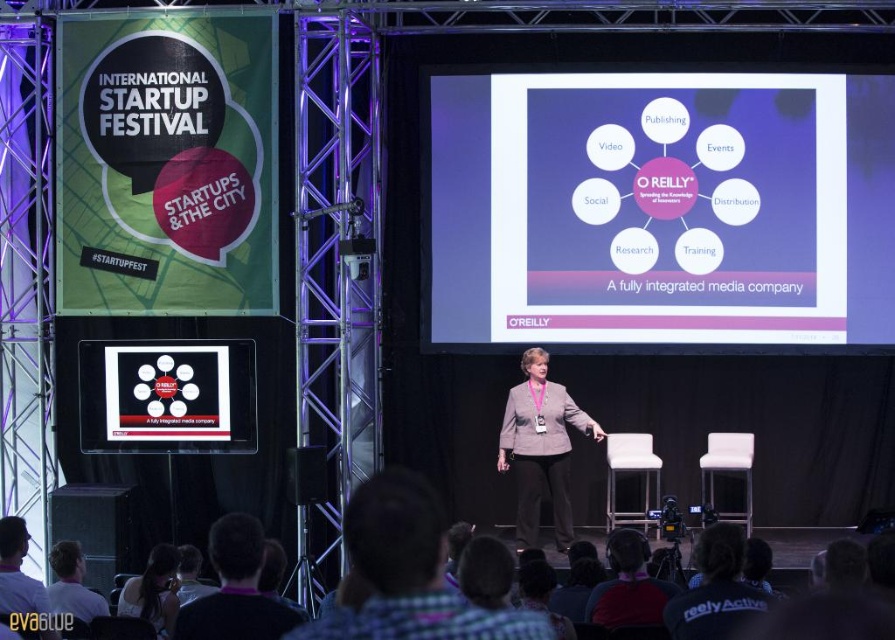
Question: Which point is farther from the camera taking this photo?

Choices:
 (A) (538, 408)
 (B) (232, 365)
 (C) (128, 556)

Answer: (B)

Question: Which point is closer to the camera?

Choices:
 (A) (663, 605)
 (B) (103, 397)

Answer: (A)

Question: Is green fabric banner at upper left smaller than dark gray fabric at lower center?

Choices:
 (A) no
 (B) yes

Answer: (B)

Question: Considering the real-world distances, which object is farthest from the dark gray fabric at lower center?

Choices:
 (A) matte black screen at center
 (B) plaid shirt at center

Answer: (A)

Question: Does dark red shirt at lower center appear under dark brown hair at lower left?

Choices:
 (A) no
 (B) yes

Answer: (A)

Question: Is purple matte circle at center wider than dark gray fabric at lower center?

Choices:
 (A) no
 (B) yes

Answer: (B)